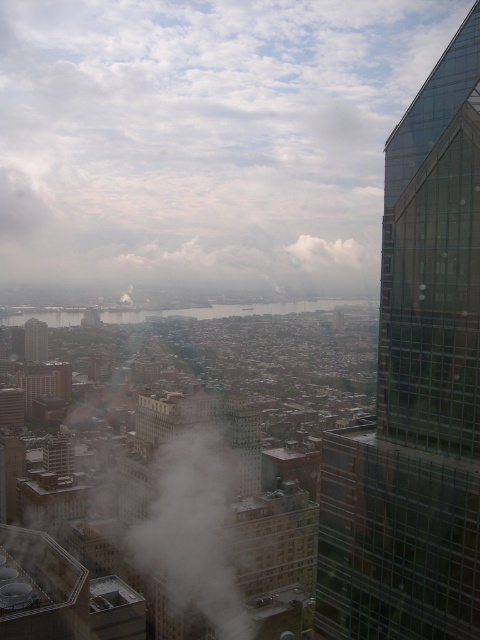
You are an architect observing the cityscape. You notice the transparent glass skyscraper at right and the white fluffy cloud at center. Which object is closer to your viewpoint?

The transparent glass skyscraper at right is closer to your viewpoint as it is positioned in front of the white fluffy cloud at center.

You are an architect observing the cityscape from a helicopter. You notice the transparent glass skyscraper at right and the white fluffy cloud at center. Which object is positioned lower in the scene?

The transparent glass skyscraper at right is positioned lower than the white fluffy cloud at center.